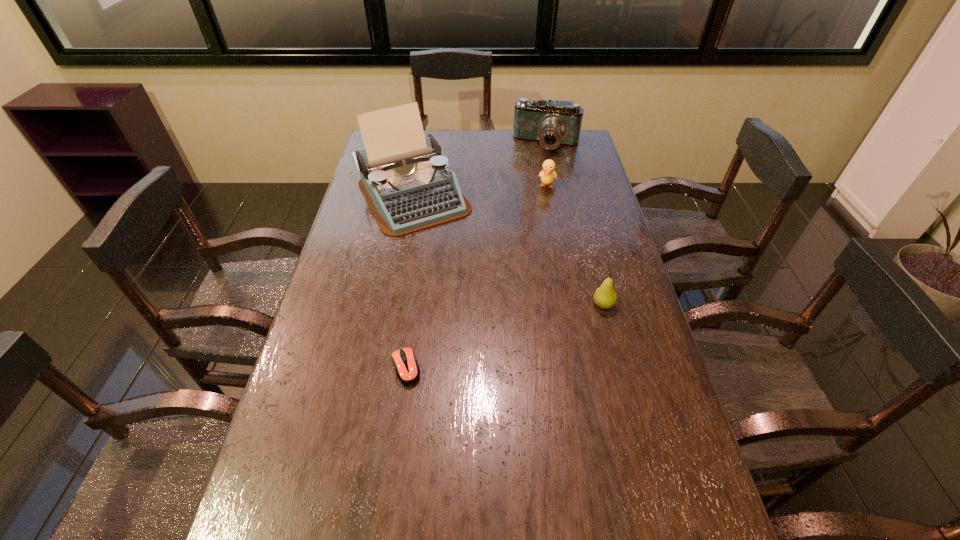
Where is `vacant space on the desktop that is between the computer mouse and the pear and is positioned on the front-facing side of the duckling`? vacant space on the desktop that is between the computer mouse and the pear and is positioned on the front-facing side of the duckling is located at coordinates (520, 331).

Where is `vacant spot on the desktop that is between the computer mouse and the pear and is positioned on the front-facing side of the farthest object`? Image resolution: width=960 pixels, height=540 pixels. vacant spot on the desktop that is between the computer mouse and the pear and is positioned on the front-facing side of the farthest object is located at coordinates point(485,342).

The image size is (960, 540). In order to click on vacant space on the desktop that is between the nearest object and the fourth farthest object and is positioned on the typing side of the tallest object in this screenshot , I will do `click(504, 336)`.